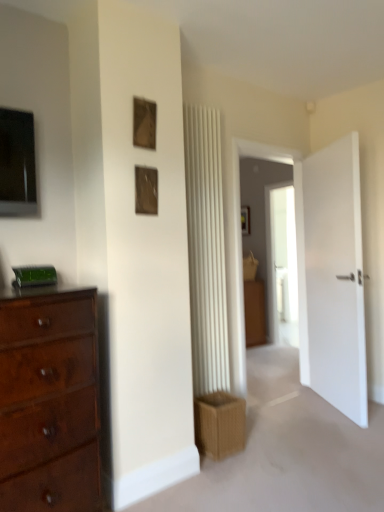
Question: Is brown cardboard crate at lower center bigger than wooden frame at upper center, which is counted as the 2th picture frame, starting from the bottom?

Choices:
 (A) yes
 (B) no

Answer: (A)

Question: Can you confirm if brown cardboard crate at lower center is thinner than wooden frame at upper center, which is counted as the 2th picture frame, starting from the bottom?

Choices:
 (A) yes
 (B) no

Answer: (B)

Question: Is brown cardboard crate at lower center turned away from wooden frame at upper center, which is counted as the 2th picture frame, starting from the bottom?

Choices:
 (A) yes
 (B) no

Answer: (B)

Question: Does brown cardboard crate at lower center touch wooden frame at upper center, the 1th picture frame when ordered from top to bottom?

Choices:
 (A) yes
 (B) no

Answer: (B)

Question: Can we say brown cardboard crate at lower center lies outside wooden frame at upper center, the 1th picture frame when ordered from top to bottom?

Choices:
 (A) no
 (B) yes

Answer: (B)

Question: Considering the positions of point (14, 437) and point (140, 182), is point (14, 437) closer or farther from the camera than point (140, 182)?

Choices:
 (A) farther
 (B) closer

Answer: (B)

Question: From the image's perspective, is mahogany wood dresser at left positioned above or below wooden picture frame at upper center, which is the first picture frame in bottom-to-top order?

Choices:
 (A) below
 (B) above

Answer: (A)

Question: Do you think mahogany wood dresser at left is within wooden picture frame at upper center, which is the first picture frame in bottom-to-top order, or outside of it?

Choices:
 (A) outside
 (B) inside

Answer: (A)

Question: From a real-world perspective, is mahogany wood dresser at left physically located above or below wooden picture frame at upper center, which is the second picture frame from top to bottom?

Choices:
 (A) below
 (B) above

Answer: (A)

Question: Is mahogany wood dresser at left taller or shorter than brown cardboard crate at lower center?

Choices:
 (A) tall
 (B) short

Answer: (A)

Question: Considering their positions, is mahogany wood dresser at left located in front of or behind brown cardboard crate at lower center?

Choices:
 (A) behind
 (B) front

Answer: (B)

Question: From the image's perspective, is mahogany wood dresser at left above or below brown cardboard crate at lower center?

Choices:
 (A) above
 (B) below

Answer: (A)

Question: Choose the correct answer: Is mahogany wood dresser at left inside brown cardboard crate at lower center or outside it?

Choices:
 (A) inside
 (B) outside

Answer: (B)

Question: In the image, is wooden frame at upper center, the 1th picture frame when ordered from top to bottom, positioned in front of or behind brown cardboard crate at lower center?

Choices:
 (A) behind
 (B) front

Answer: (B)

Question: Is wooden frame at upper center, the 1th picture frame when ordered from top to bottom, spatially inside brown cardboard crate at lower center, or outside of it?

Choices:
 (A) inside
 (B) outside

Answer: (B)